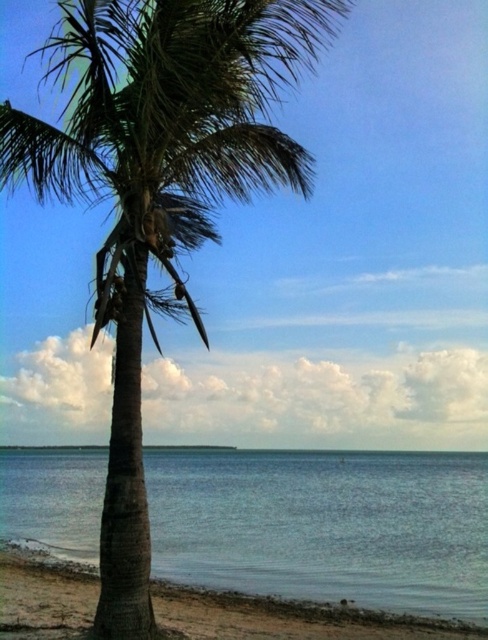
You are standing on the beach and see the green leafy coconut tree at center and the blue water at center. Which object is taller?

The green leafy coconut tree at center is taller than the blue water at center.

You are a photographer trying to capture the green leafy coconut tree at center and the blue water at center in a single frame. Based on their sizes in the image, which object would appear more prominent in the photo?

The green leafy coconut tree at center appears more prominent in the photo because it has a larger size compared to the blue water at center.

Consider the image. You are standing on the sandy brown beach at lower left and want to reach the blue water at center. Based on the scene description, which direction should you walk to get to the water?

You should walk towards the center of the scene because the blue water at center is located in that direction from the sandy brown beach at lower left.